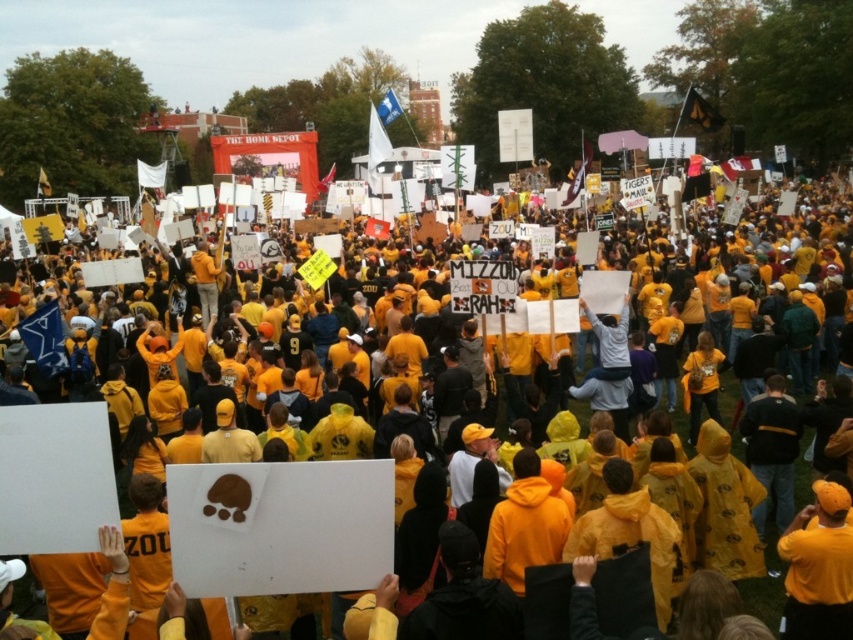
Question: Is yellow matte raincoat at center to the left of light gray sweater at center from the viewer's perspective?

Choices:
 (A) yes
 (B) no

Answer: (B)

Question: Which of the following is the closest to the observer?

Choices:
 (A) (621, 394)
 (B) (763, 449)

Answer: (B)

Question: Which point appears closest to the camera in this image?

Choices:
 (A) (619, 337)
 (B) (38, 604)

Answer: (B)

Question: Is yellow matte raincoat at center smaller than light gray sweater at center?

Choices:
 (A) no
 (B) yes

Answer: (A)

Question: In this image, where is yellow matte raincoat at center located relative to light gray sweater at center?

Choices:
 (A) left
 (B) right

Answer: (B)